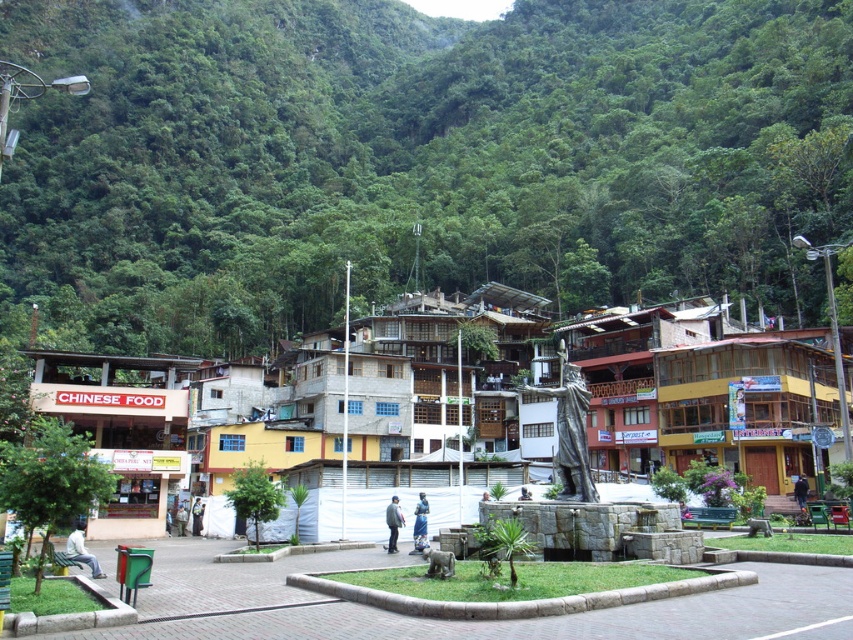
Question: Among these objects, which one is farthest from the camera?

Choices:
 (A) bronze statue at center
 (B) blue metallic statue at center
 (C) matte stone statue at center
 (D) light blue fabric bench at lower left

Answer: (B)

Question: Which object is positioned closest to the light blue fabric bench at lower left?

Choices:
 (A) dark blue jacket at center
 (B) bronze statue at center
 (C) matte stone statue at center
 (D) green leafy forest at upper center

Answer: (B)

Question: Where is matte stone statue at center located in relation to dark gray jacket at center in the image?

Choices:
 (A) above
 (B) below

Answer: (A)

Question: Can you confirm if dark gray jacket at center is positioned to the left of dark blue jacket at center?

Choices:
 (A) no
 (B) yes

Answer: (B)

Question: Is matte stone statue at center to the left of light blue fabric bench at lower left from the viewer's perspective?

Choices:
 (A) yes
 (B) no

Answer: (B)

Question: Which object is positioned farthest from the dark blue jacket at center?

Choices:
 (A) blue metallic statue at center
 (B) dark gray jacket at center
 (C) green leafy forest at upper center
 (D) matte stone statue at center

Answer: (C)